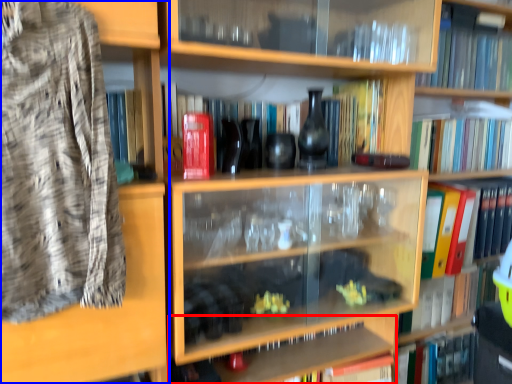
Question: Which object appears farthest to the camera in this image, cabinet (highlighted by a red box) or shelf (highlighted by a blue box)?

Choices:
 (A) cabinet
 (B) shelf

Answer: (A)